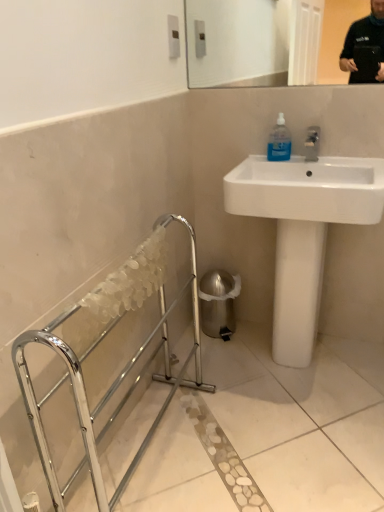
What is the approximate height of transparent plastic bottle at upper right?

The height of transparent plastic bottle at upper right is 7.43 inches.

This screenshot has width=384, height=512. In order to click on shiny metallic trash can at lower right in this screenshot , I will do `click(218, 303)`.

Considering the sizes of objects chrome metallic balustrade at lower left and transparent plastic bottle at upper right in the image provided, who is bigger, chrome metallic balustrade at lower left or transparent plastic bottle at upper right?

With larger size is chrome metallic balustrade at lower left.

From a real-world perspective, who is located higher, chrome metallic balustrade at lower left or transparent plastic bottle at upper right?

transparent plastic bottle at upper right.

Is chrome metallic balustrade at lower left not inside transparent plastic bottle at upper right?

chrome metallic balustrade at lower left lies outside transparent plastic bottle at upper right's area.

Are chrome metallic balustrade at lower left and transparent plastic bottle at upper right far apart?

No, chrome metallic balustrade at lower left is not far from transparent plastic bottle at upper right.

Does transparent plastic bottle at upper right have a lesser height compared to chrome metallic balustrade at lower left?

Yes, transparent plastic bottle at upper right is shorter than chrome metallic balustrade at lower left.

Is transparent plastic bottle at upper right positioned with its back to chrome metallic balustrade at lower left?

No, transparent plastic bottle at upper right's orientation is not away from chrome metallic balustrade at lower left.

How different are the orientations of transparent plastic bottle at upper right and chrome metallic balustrade at lower left in degrees?

They differ by 91 degrees in their facing directions.

Can you confirm if transparent plastic bottle at upper right is wider than chrome metallic balustrade at lower left?

Incorrect, the width of transparent plastic bottle at upper right does not surpass that of chrome metallic balustrade at lower left.

Which object is more forward, chrome metallic balustrade at lower left or white glossy sink at upper right?

chrome metallic balustrade at lower left is closer to the camera.

In the scene shown: Could you tell me if chrome metallic balustrade at lower left is turned towards white glossy sink at upper right?

No.

Looking at this image, is chrome metallic balustrade at lower left inside the boundaries of white glossy sink at upper right, or outside?

chrome metallic balustrade at lower left is not inside white glossy sink at upper right, it's outside.

Locate an element on the screen. Image resolution: width=384 pixels, height=512 pixels. balustrade that is below the white glossy sink at upper right (from the image's perspective) is located at coordinates (108, 389).

Between point (276, 170) and point (228, 283), which one is positioned behind?

Positioned behind is point (228, 283).

At what (x,y) coordinates should I click in order to perform the action: click on sink above the shiny metallic trash can at lower right (from the image's perspective). Please return your answer as a coordinate pair (x, y). This screenshot has width=384, height=512. Looking at the image, I should click on (303, 230).

Considering the positions of objects white glossy sink at upper right and shiny metallic trash can at lower right in the image provided, who is more to the right, white glossy sink at upper right or shiny metallic trash can at lower right?

From the viewer's perspective, white glossy sink at upper right appears more on the right side.

Is white glossy sink at upper right completely or partially outside of shiny metallic trash can at lower right?

Indeed, white glossy sink at upper right is completely outside shiny metallic trash can at lower right.

Considering the sizes of objects shiny metallic trash can at lower right and transparent plastic bottle at upper right in the image provided, who is smaller, shiny metallic trash can at lower right or transparent plastic bottle at upper right?

transparent plastic bottle at upper right.

Consider the image. Which object is further away from the camera taking this photo, shiny metallic trash can at lower right or transparent plastic bottle at upper right?

shiny metallic trash can at lower right is behind.

From the image's perspective, is shiny metallic trash can at lower right on transparent plastic bottle at upper right?

Incorrect, from the image's perspective, shiny metallic trash can at lower right is lower than transparent plastic bottle at upper right.

Can you see white glossy sink at upper right touching transparent plastic bottle at upper right?

No, white glossy sink at upper right is not next to transparent plastic bottle at upper right.

Does white glossy sink at upper right have a smaller size compared to transparent plastic bottle at upper right?

Actually, white glossy sink at upper right might be larger than transparent plastic bottle at upper right.

Considering the positions of objects white glossy sink at upper right and transparent plastic bottle at upper right in the image provided, who is behind, white glossy sink at upper right or transparent plastic bottle at upper right?

transparent plastic bottle at upper right is behind.

Is white glossy sink at upper right positioned beyond the bounds of chrome metallic balustrade at lower left?

That's correct, white glossy sink at upper right is outside of chrome metallic balustrade at lower left.

Which of these two, white glossy sink at upper right or chrome metallic balustrade at lower left, is thinner?

With smaller width is chrome metallic balustrade at lower left.

Who is bigger, white glossy sink at upper right or chrome metallic balustrade at lower left?

Bigger between the two is white glossy sink at upper right.

The width and height of the screenshot is (384, 512). What are the coordinates of `balustrade that appears on the left of transparent plastic bottle at upper right` in the screenshot? It's located at (108, 389).

This screenshot has width=384, height=512. What are the coordinates of `mouthwash above the chrome metallic balustrade at lower left (from a real-world perspective)` in the screenshot? It's located at (279, 141).

Looking at the image, which one is located closer to shiny metallic trash can at lower right, transparent plastic bottle at upper right or white glossy sink at upper right?

The object closer to shiny metallic trash can at lower right is white glossy sink at upper right.

Based on their spatial positions, is chrome metallic balustrade at lower left or white glossy sink at upper right further from shiny metallic trash can at lower right?

white glossy sink at upper right.

From the image, which object appears to be farther from white glossy sink at upper right, shiny metallic trash can at lower right or transparent plastic bottle at upper right?

Among the two, shiny metallic trash can at lower right is located further to white glossy sink at upper right.

When comparing their distances from transparent plastic bottle at upper right, does white glossy sink at upper right or chrome metallic balustrade at lower left seem further?

Among the two, chrome metallic balustrade at lower left is located further to transparent plastic bottle at upper right.

Estimate the real-world distances between objects in this image. Which object is further from white glossy sink at upper right, transparent plastic bottle at upper right or chrome metallic balustrade at lower left?

chrome metallic balustrade at lower left is positioned further to the anchor white glossy sink at upper right.

From the image, which object appears to be nearer to shiny metallic trash can at lower right, transparent plastic bottle at upper right or chrome metallic balustrade at lower left?

Based on the image, chrome metallic balustrade at lower left appears to be nearer to shiny metallic trash can at lower right.

Based on their spatial positions, is chrome metallic balustrade at lower left or shiny metallic trash can at lower right closer to white glossy sink at upper right?

Based on the image, shiny metallic trash can at lower right appears to be nearer to white glossy sink at upper right.

Which object lies nearer to the anchor point chrome metallic balustrade at lower left, white glossy sink at upper right or transparent plastic bottle at upper right?

white glossy sink at upper right.

This screenshot has height=512, width=384. I want to click on sink that lies between transparent plastic bottle at upper right and shiny metallic trash can at lower right from top to bottom, so click(303, 230).

Find the location of a particular element. This screenshot has height=512, width=384. mouthwash positioned between chrome metallic balustrade at lower left and shiny metallic trash can at lower right from near to far is located at coordinates pos(279,141).

Identify the location of sink positioned between chrome metallic balustrade at lower left and transparent plastic bottle at upper right from near to far. Image resolution: width=384 pixels, height=512 pixels. (303, 230).

This screenshot has height=512, width=384. I want to click on sink positioned between chrome metallic balustrade at lower left and shiny metallic trash can at lower right from near to far, so click(x=303, y=230).